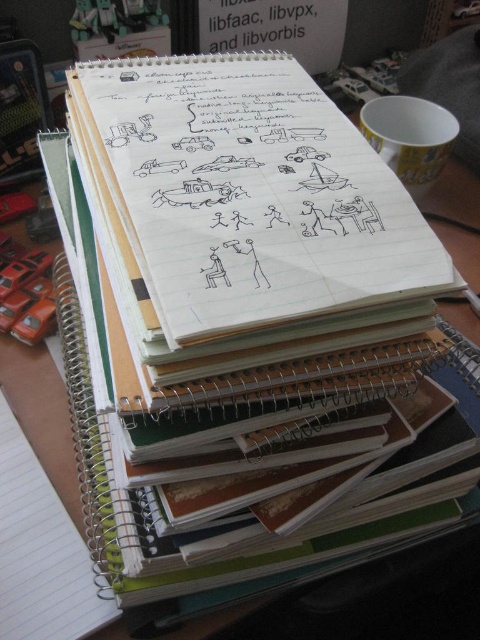
Question: Is white lined paper at center below black paper at upper center?

Choices:
 (A) yes
 (B) no

Answer: (A)

Question: Among these objects, which one is nearest to the camera?

Choices:
 (A) white lined paper at center
 (B) black paper at upper center

Answer: (A)

Question: Which of the following is the farthest from the observer?

Choices:
 (A) (288, 0)
 (B) (431, 272)

Answer: (A)

Question: Does white lined paper at center lie behind black paper at upper center?

Choices:
 (A) yes
 (B) no

Answer: (B)

Question: Can you confirm if white lined paper at center is positioned to the right of black paper at upper center?

Choices:
 (A) no
 (B) yes

Answer: (A)